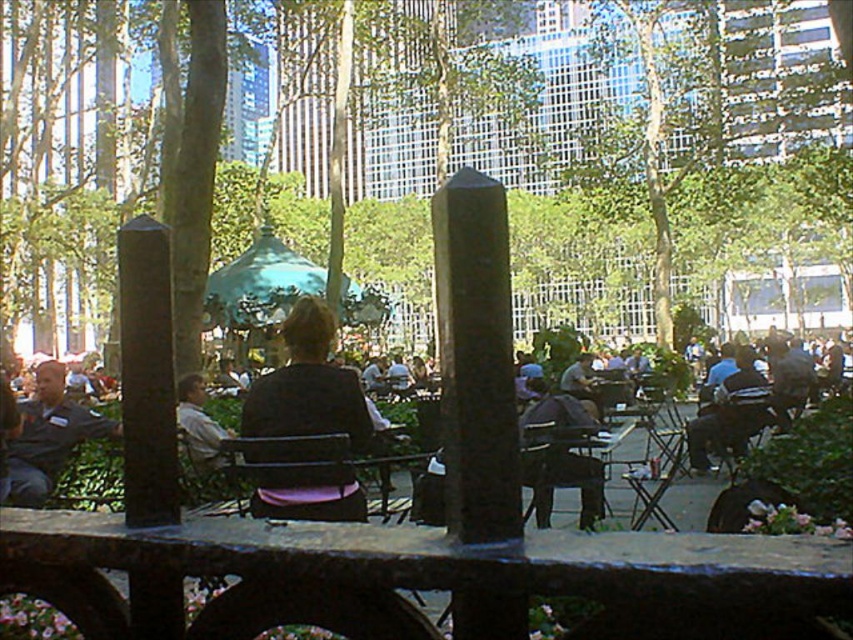
Is dark brown leather jacket at center to the left of black plastic chair at center from the viewer's perspective?

In fact, dark brown leather jacket at center is to the right of black plastic chair at center.

Is dark brown leather jacket at center thinner than black plastic chair at center?

No, dark brown leather jacket at center is not thinner than black plastic chair at center.

Does point (822, 429) come farther from viewer compared to point (567, 460)?

Yes, it is behind point (567, 460).

You are a GUI agent. You are given a task and a screenshot of the screen. Output one action in this format:
    pyautogui.click(x=<x>, y=<y>)
    Task: Click on the dark brown leather jacket at center
    
    Given the screenshot: What is the action you would take?
    pyautogui.click(x=808, y=461)

Can you confirm if green leafy tree at center is shorter than black fabric chair at center?

Incorrect, green leafy tree at center's height does not fall short of black fabric chair at center's.

Can you confirm if green leafy tree at center is smaller than black fabric chair at center?

No, green leafy tree at center is not smaller than black fabric chair at center.

Between point (733, 20) and point (297, 380), which one is positioned in front?

Point (297, 380)

I want to click on green leafy tree at center, so click(x=564, y=168).

Does black fabric chair at center appear on the left side of black plastic chair at center?

Indeed, black fabric chair at center is positioned on the left side of black plastic chair at center.

Between point (335, 488) and point (584, 436), which one is positioned behind?

The point (584, 436) is more distant.

Identify the location of black fabric chair at center. (306, 385).